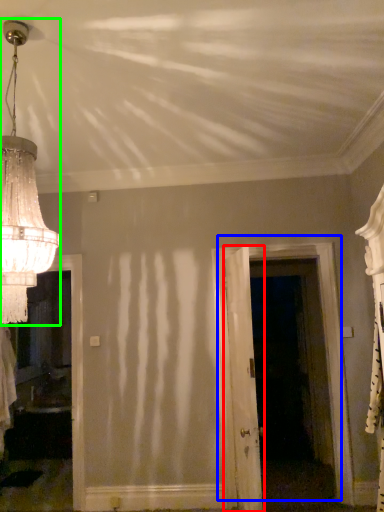
Question: Estimate the real-world distances between objects in this image. Which object is farther from door (highlighted by a red box), door (highlighted by a blue box) or lamp (highlighted by a green box)?

Choices:
 (A) door
 (B) lamp

Answer: (B)